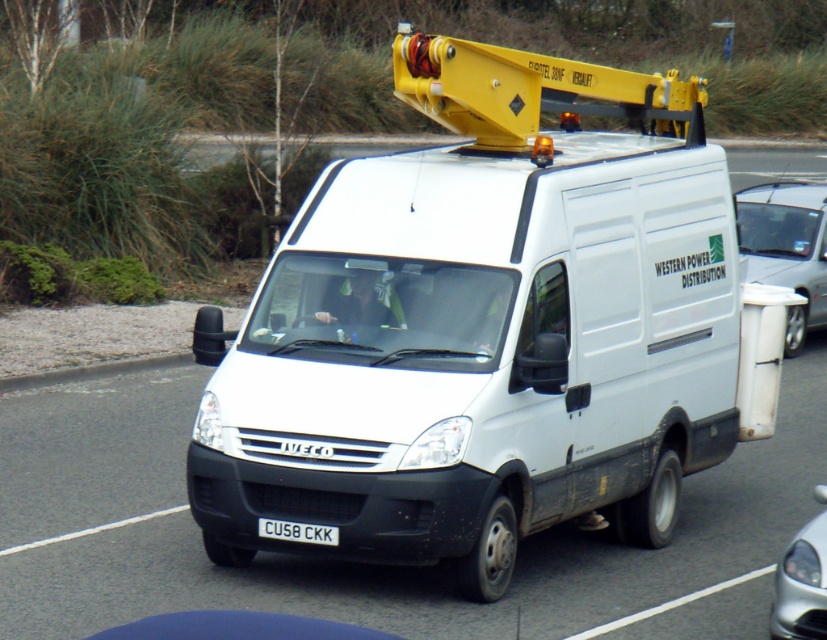
Question: Is white matte van at center positioned at the back of white plastic trash can at right?

Choices:
 (A) yes
 (B) no

Answer: (B)

Question: Which of the following is the farthest from the observer?

Choices:
 (A) pyautogui.click(x=796, y=196)
 (B) pyautogui.click(x=333, y=529)

Answer: (A)

Question: Among these points, which one is nearest to the camera?

Choices:
 (A) (805, 208)
 (B) (330, 528)

Answer: (B)

Question: Does white glossy car at center lie in front of white plastic license plate at center?

Choices:
 (A) yes
 (B) no

Answer: (A)

Question: Which point is farther from the camera taking this photo?

Choices:
 (A) (477, 428)
 (B) (318, 529)

Answer: (B)

Question: Does white glossy car at center lie in front of white plastic license plate at center?

Choices:
 (A) yes
 (B) no

Answer: (A)